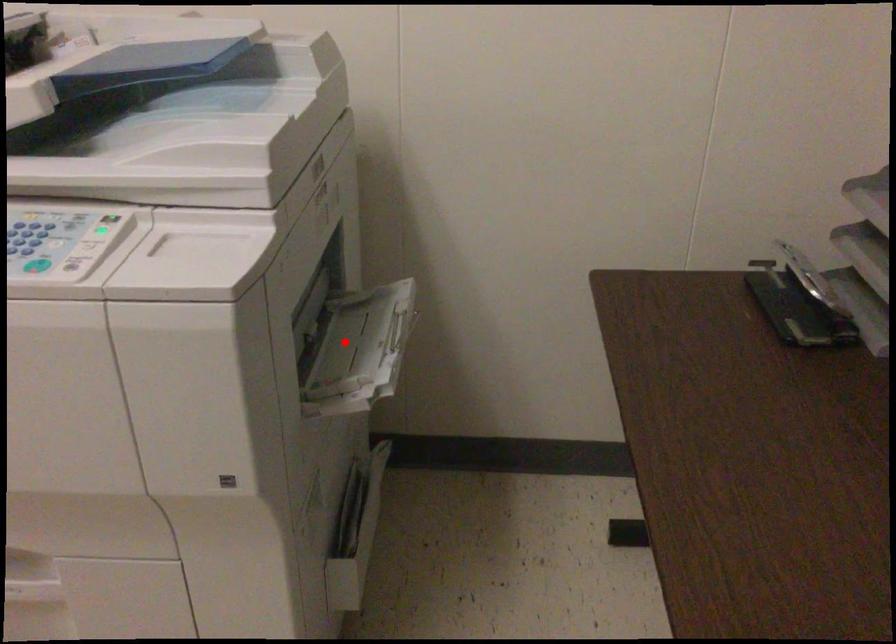
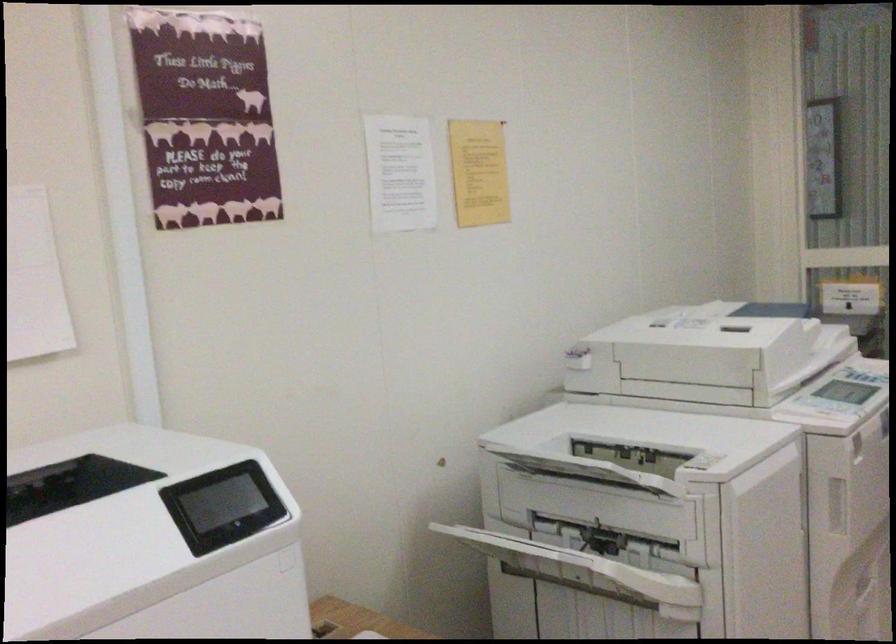
Question: I am providing you with two images of the same scene from different viewpoints. A red point is marked on the first image. Is the red point's position out of view in image 2?

Choices:
 (A) Yes
 (B) No

Answer: (A)